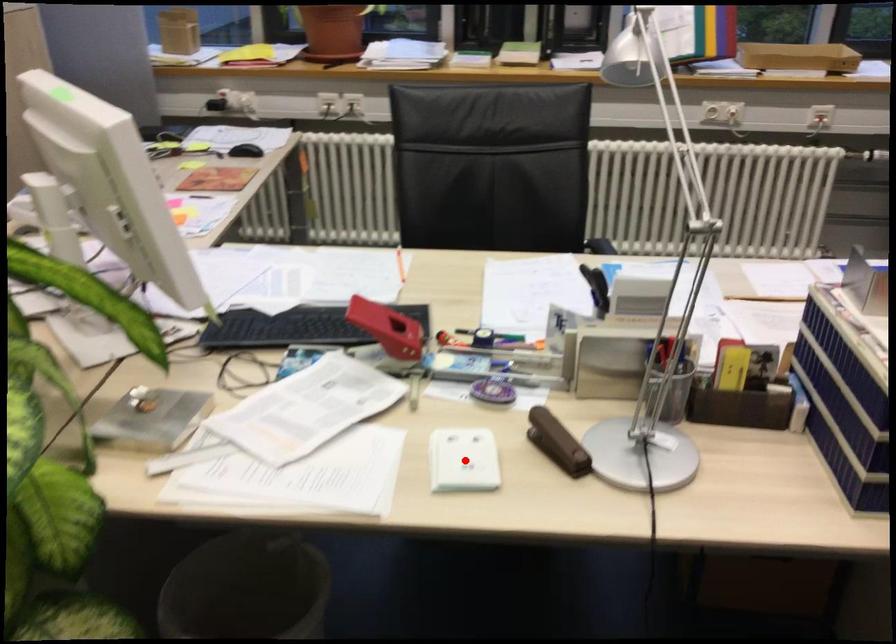
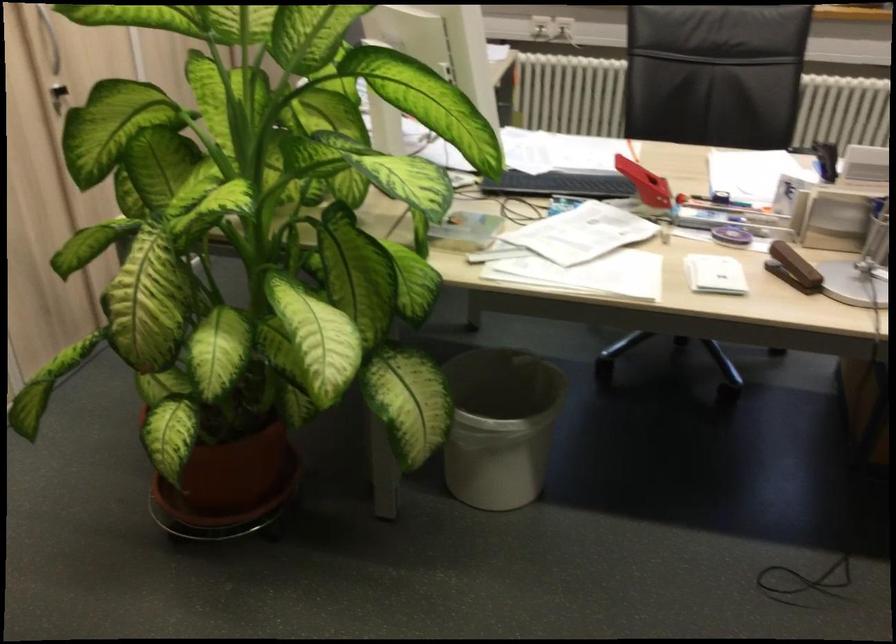
The point at the highlighted location is marked in the first image. Where is the corresponding point in the second image?

(714, 274)